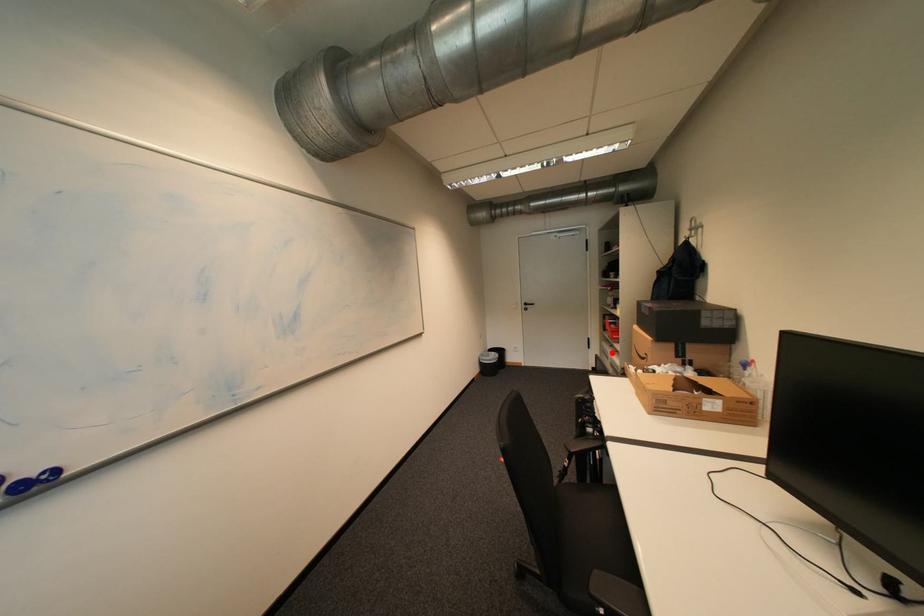
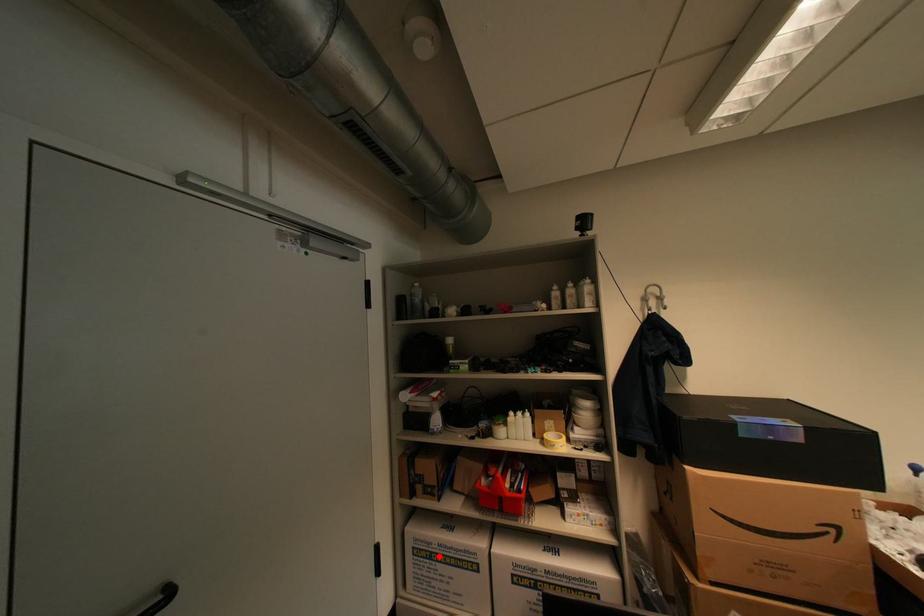
I am providing you with two images of the same scene from different viewpoints. A red point is marked on the first image and another point is marked on the second image. Do the highlighted points in image1 and image2 indicate the same real-world spot?

Yes